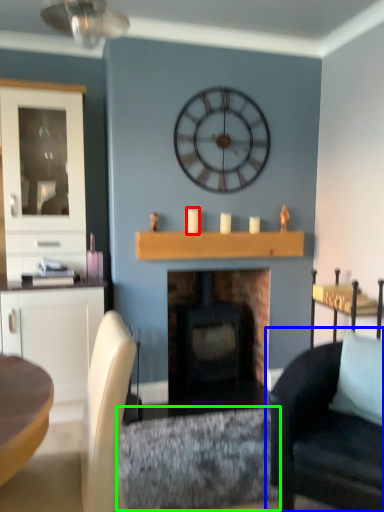
Question: Which object is positioned closest to candle (highlighted by a red box)? Select from chair (highlighted by a blue box) and molding (highlighted by a green box).

Choices:
 (A) chair
 (B) molding

Answer: (B)